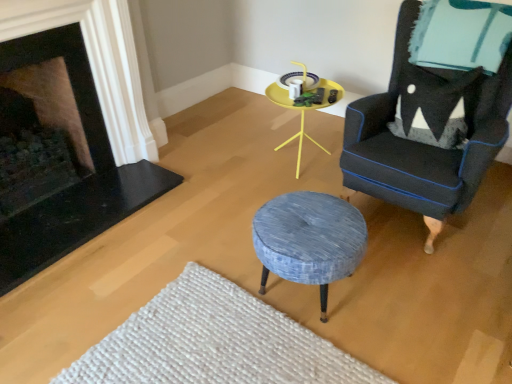
You are a GUI agent. You are given a task and a screenshot of the screen. Output one action in this format:
    pyautogui.click(x=<x>, y=<y>)
    Task: Click on the free location in front of velvet dark blue armchair at right
    
    Given the screenshot: What is the action you would take?
    [x=438, y=296]